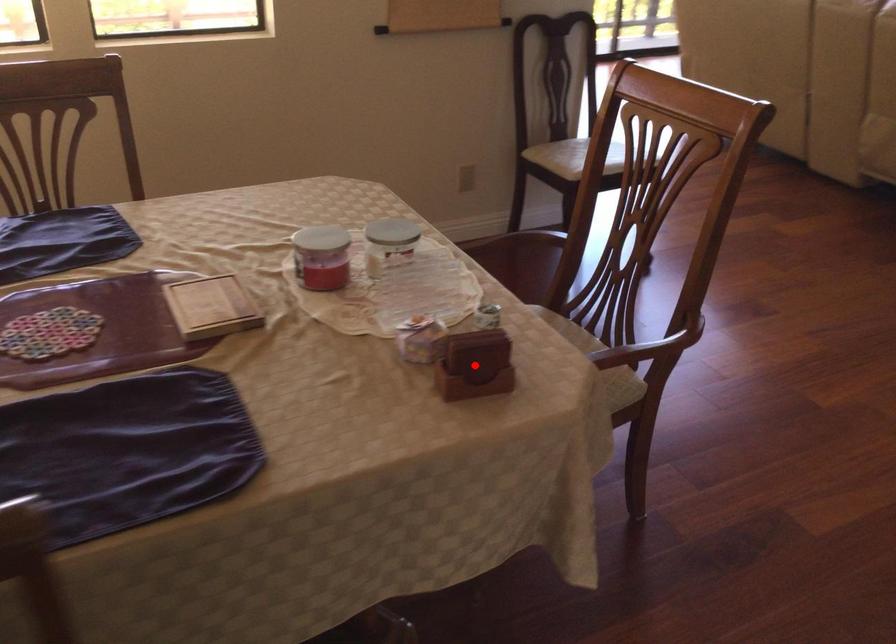
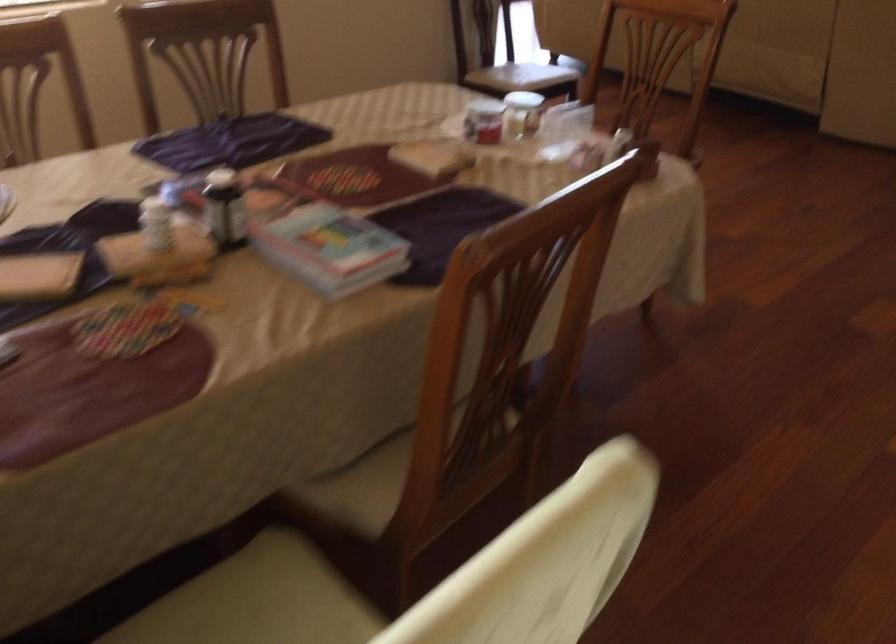
Question: I am providing you with two images of the same scene from different viewpoints. A red point is marked on the first image. Is the red point's position out of view in image 2?

Choices:
 (A) Yes
 (B) No

Answer: (A)